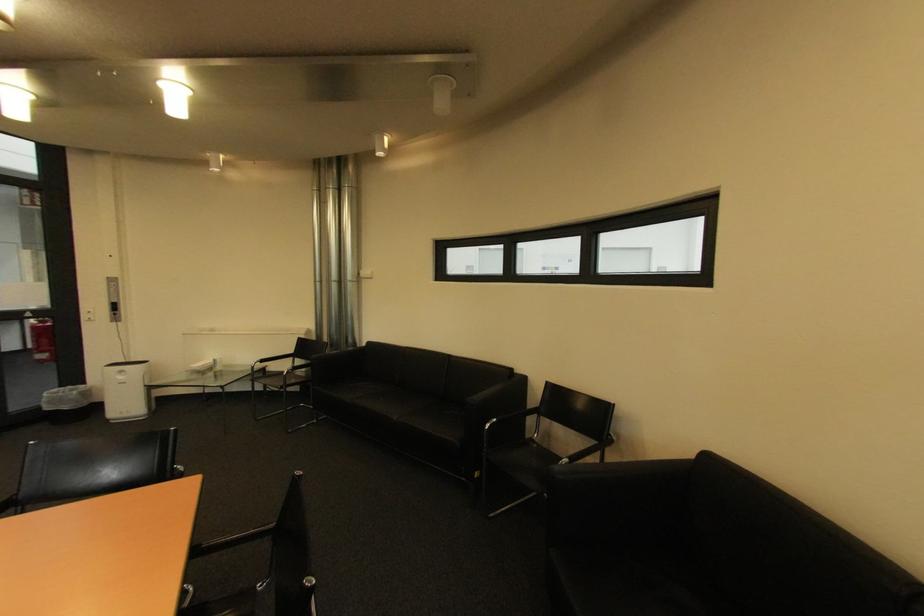
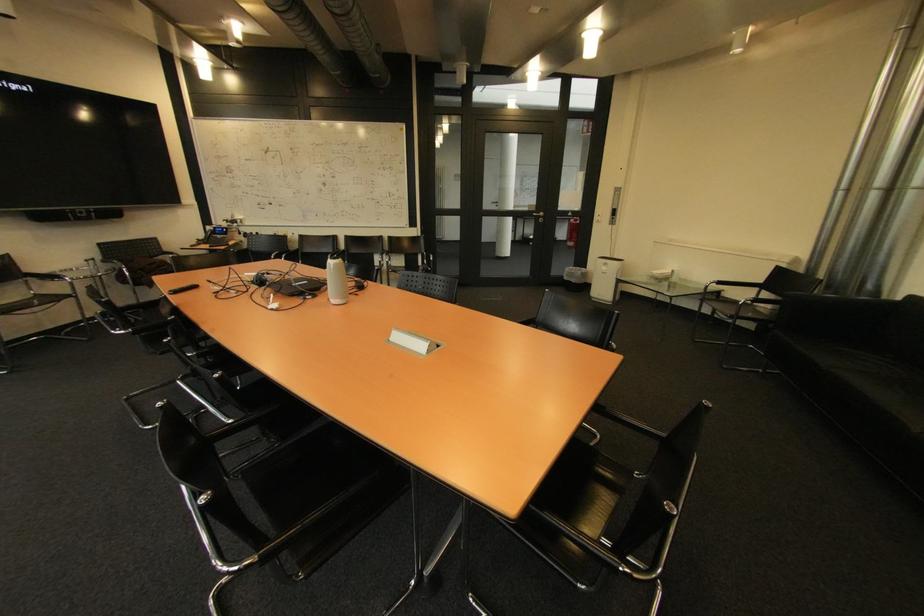
Find the pixel in the second image that matches (367,347) in the first image.

(893, 300)